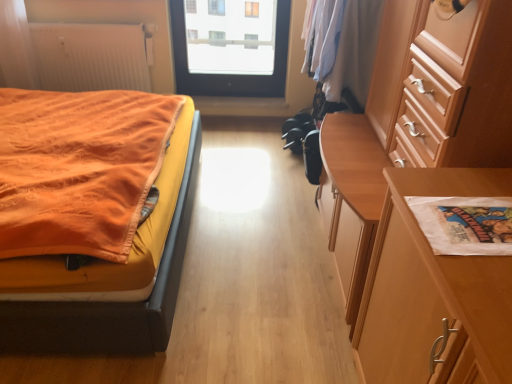
This screenshot has height=384, width=512. In order to click on empty space that is ontop of white ribbed radiator at upper left (from a real-world perspective) in this screenshot , I will do `click(80, 18)`.